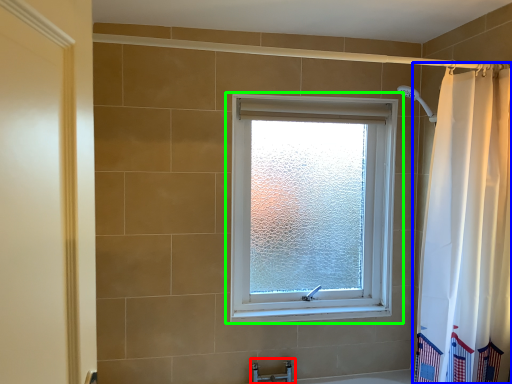
Question: Which is farther away from faucet (highlighted by a red box)? curtain (highlighted by a blue box) or window (highlighted by a green box)?

Choices:
 (A) curtain
 (B) window

Answer: (A)